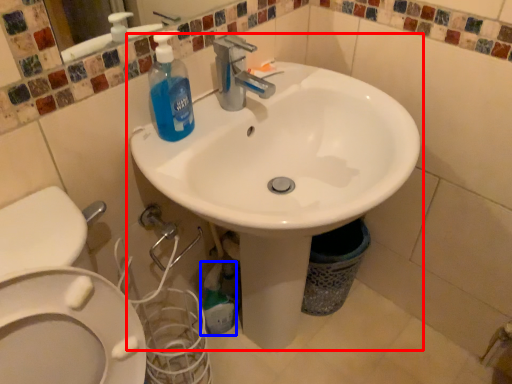
Question: Which of the following is the farthest to the observer, sink (highlighted by a red box) or cleaning product (highlighted by a blue box)?

Choices:
 (A) sink
 (B) cleaning product

Answer: (B)